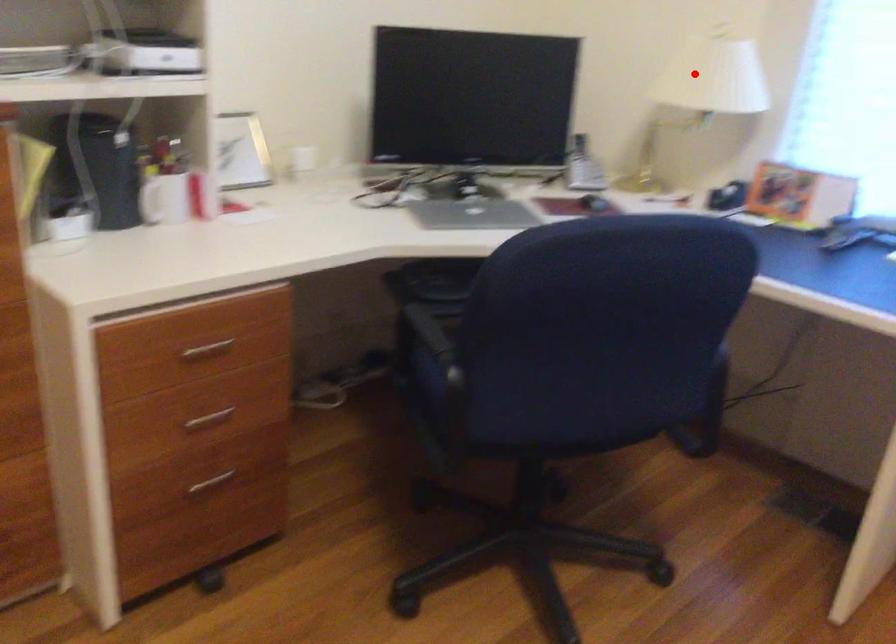
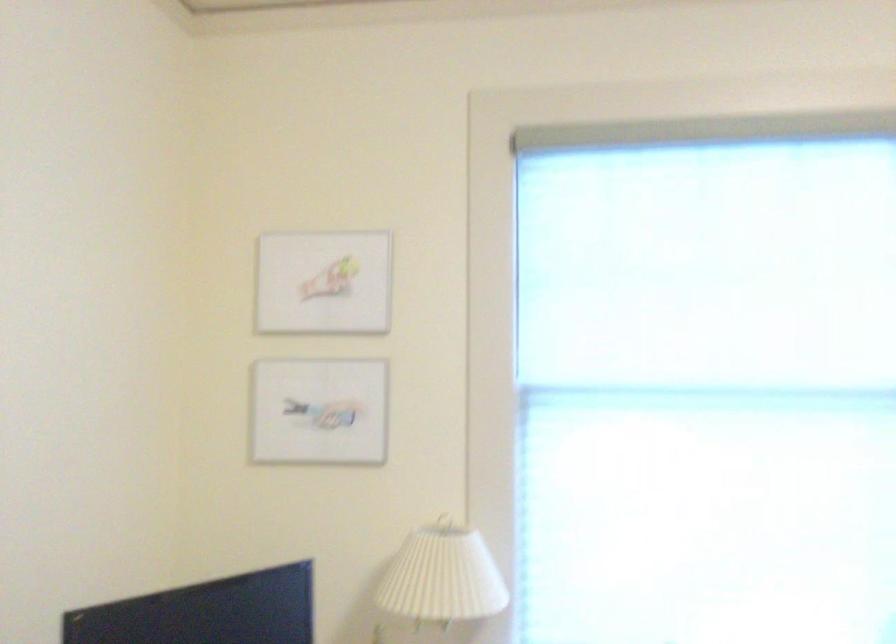
The point at the highlighted location is marked in the first image. Where is the corresponding point in the second image?

(443, 576)